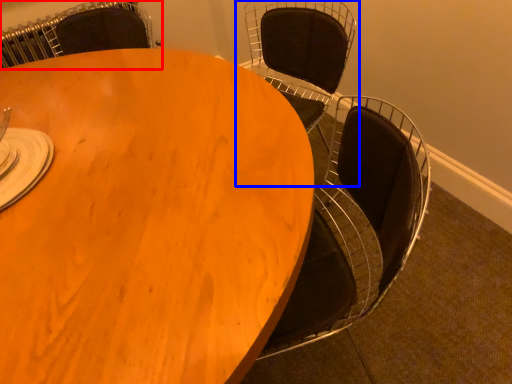
Question: Which object is further to the camera taking this photo, chair (highlighted by a red box) or chair (highlighted by a blue box)?

Choices:
 (A) chair
 (B) chair

Answer: (A)